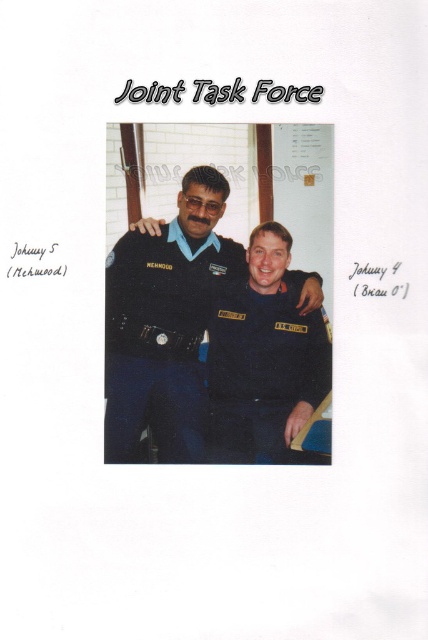
Question: Is matte black uniform at center further to camera compared to dark blue fabric uniform at center?

Choices:
 (A) no
 (B) yes

Answer: (A)

Question: Which of the following is the farthest from the observer?

Choices:
 (A) (118, 404)
 (B) (246, 378)

Answer: (B)

Question: Is matte black uniform at center below dark blue fabric uniform at center?

Choices:
 (A) no
 (B) yes

Answer: (A)

Question: Can you confirm if matte black uniform at center is wider than dark blue fabric uniform at center?

Choices:
 (A) yes
 (B) no

Answer: (A)

Question: Which point appears farthest from the camera in this image?

Choices:
 (A) (255, 392)
 (B) (122, 324)

Answer: (A)